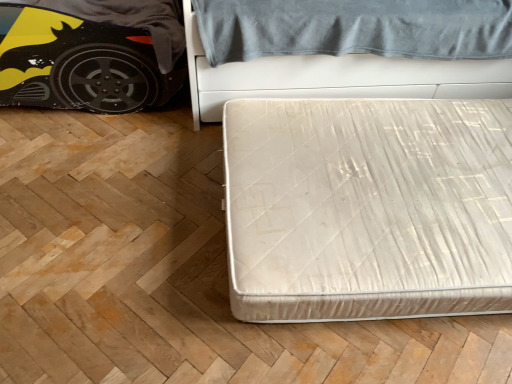
Question: Based on their positions, is white fabric mattress at lower right, which is the second bed in top-to-bottom order, located to the left or right of matt black car at left?

Choices:
 (A) right
 (B) left

Answer: (A)

Question: From the image's perspective, relative to matt black car at left, is white fabric mattress at lower right, acting as the 1th bed starting from the bottom, above or below?

Choices:
 (A) below
 (B) above

Answer: (A)

Question: Which of these objects is positioned closest to the white textured mattress at center, which is counted as the first bed, starting from the top?

Choices:
 (A) white fabric mattress at lower right, which is the second bed in top-to-bottom order
 (B) matt black car at left

Answer: (A)

Question: Considering the real-world distances, which object is farthest from the matt black car at left?

Choices:
 (A) white fabric mattress at lower right, which is the second bed in top-to-bottom order
 (B) white textured mattress at center, acting as the second bed starting from the bottom

Answer: (A)